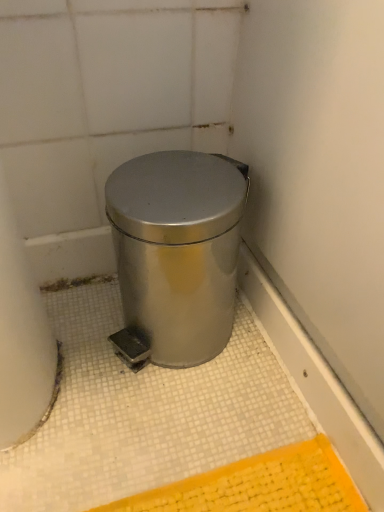
Find the location of `satin silver trash can at center`. satin silver trash can at center is located at coordinates (178, 250).

The height and width of the screenshot is (512, 384). Describe the element at coordinates (178, 250) in the screenshot. I see `satin silver trash can at center` at that location.

Where is `satin silver trash can at center`? satin silver trash can at center is located at coordinates (178, 250).